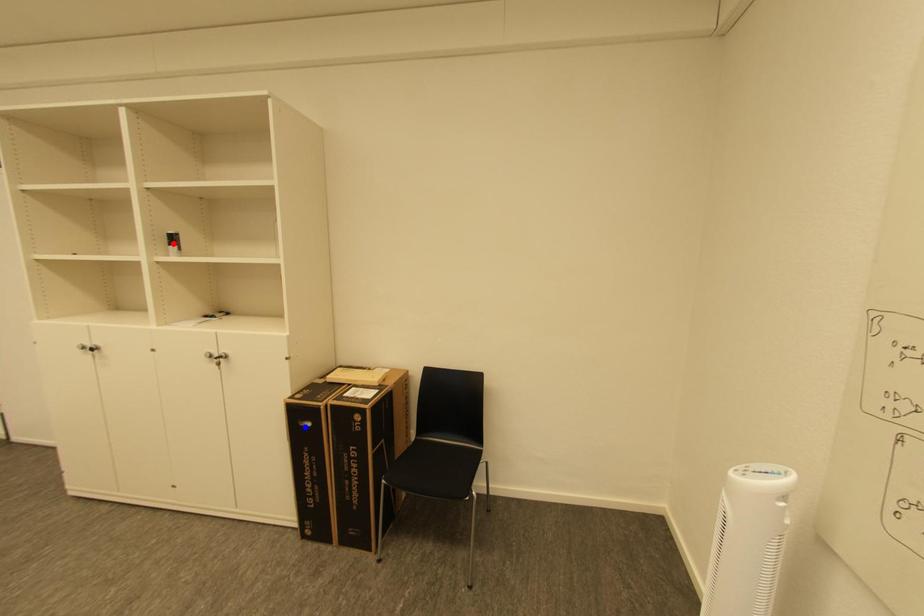
Question: In the image, two points are highlighted. Which point is nearer to the camera? Reply with the corresponding letter.

Choices:
 (A) blue point
 (B) red point

Answer: (A)